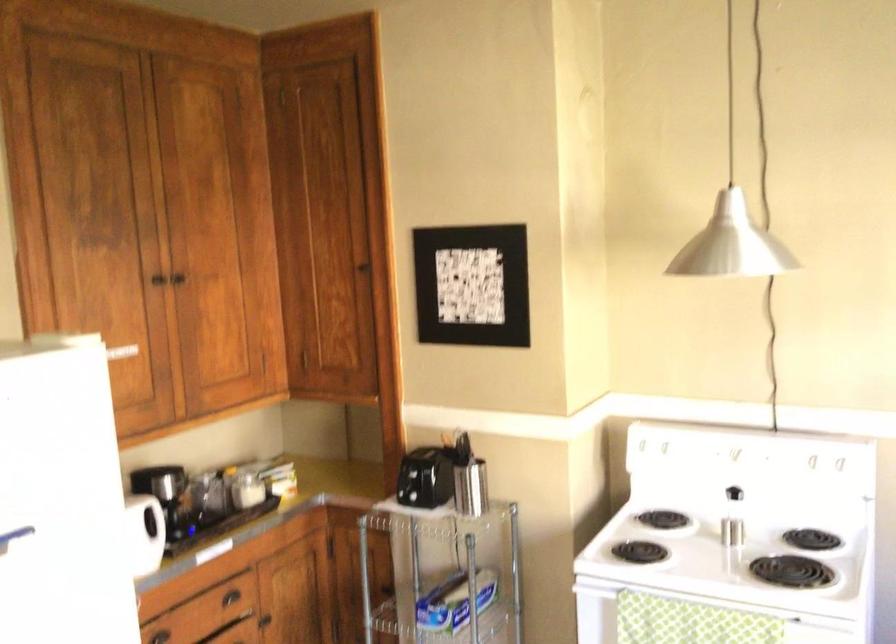
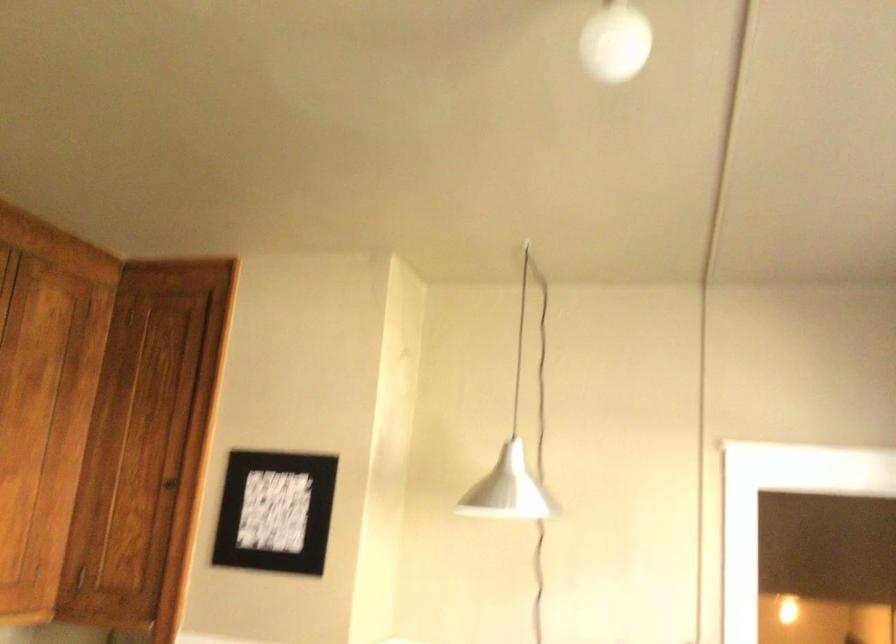
Where in the second image is the point corresponding to pixel 202 202 from the first image?

(23, 397)